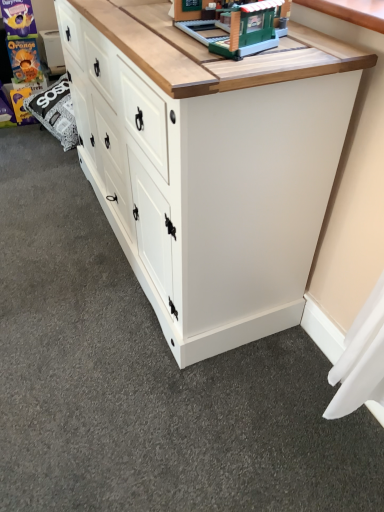
Locate an element on the screen. This screenshot has height=512, width=384. vacant area located to the right-hand side of green plastic building at upper center is located at coordinates [x=329, y=40].